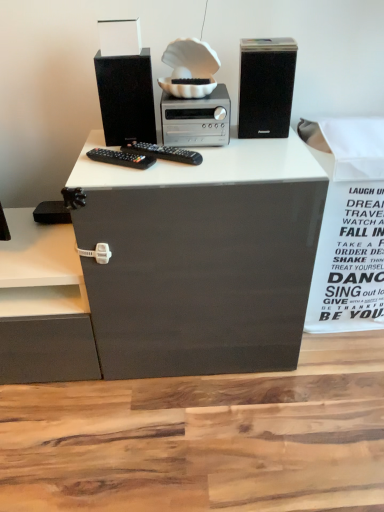
Question: Is white paper at right to the left of black matte speaker at upper right, the 2th computer tower when ordered from left to right, from the viewer's perspective?

Choices:
 (A) yes
 (B) no

Answer: (B)

Question: From a real-world perspective, is white paper at right on top of black matte speaker at upper right, which is the 1th computer tower in right-to-left order?

Choices:
 (A) no
 (B) yes

Answer: (A)

Question: Considering the relative sizes of white paper at right and black matte speaker at upper right, which is the 1th computer tower in right-to-left order, in the image provided, is white paper at right taller than black matte speaker at upper right, which is the 1th computer tower in right-to-left order,?

Choices:
 (A) no
 (B) yes

Answer: (B)

Question: From the image's perspective, is white paper at right located above black matte speaker at upper right, which is the 1th computer tower in right-to-left order?

Choices:
 (A) yes
 (B) no

Answer: (B)

Question: Can we say white paper at right lies outside black matte speaker at upper right, the 2th computer tower when ordered from left to right?

Choices:
 (A) yes
 (B) no

Answer: (A)

Question: Can you confirm if white paper at right is smaller than black matte speaker at upper right, the 2th computer tower when ordered from left to right?

Choices:
 (A) no
 (B) yes

Answer: (A)

Question: Can you confirm if white paper at right is smaller than matte black speaker at upper left, which ranks as the 1th computer tower in left-to-right order?

Choices:
 (A) no
 (B) yes

Answer: (A)

Question: Does white paper at right appear on the right side of matte black speaker at upper left, the second computer tower from the right?

Choices:
 (A) no
 (B) yes

Answer: (B)

Question: From the image's perspective, is white paper at right under matte black speaker at upper left, the second computer tower from the right?

Choices:
 (A) yes
 (B) no

Answer: (A)

Question: Is white paper at right closer to camera compared to matte black speaker at upper left, the second computer tower from the right?

Choices:
 (A) yes
 (B) no

Answer: (B)

Question: From the image's perspective, is white paper at right on matte black speaker at upper left, which ranks as the 1th computer tower in left-to-right order?

Choices:
 (A) yes
 (B) no

Answer: (B)

Question: Does white paper at right appear on the left side of matte black speaker at upper left, the second computer tower from the right?

Choices:
 (A) yes
 (B) no

Answer: (B)

Question: Is black matte speaker at upper right, which is the 1th computer tower in right-to-left order, looking in the opposite direction of matte black speaker at upper left, which ranks as the 1th computer tower in left-to-right order?

Choices:
 (A) no
 (B) yes

Answer: (A)